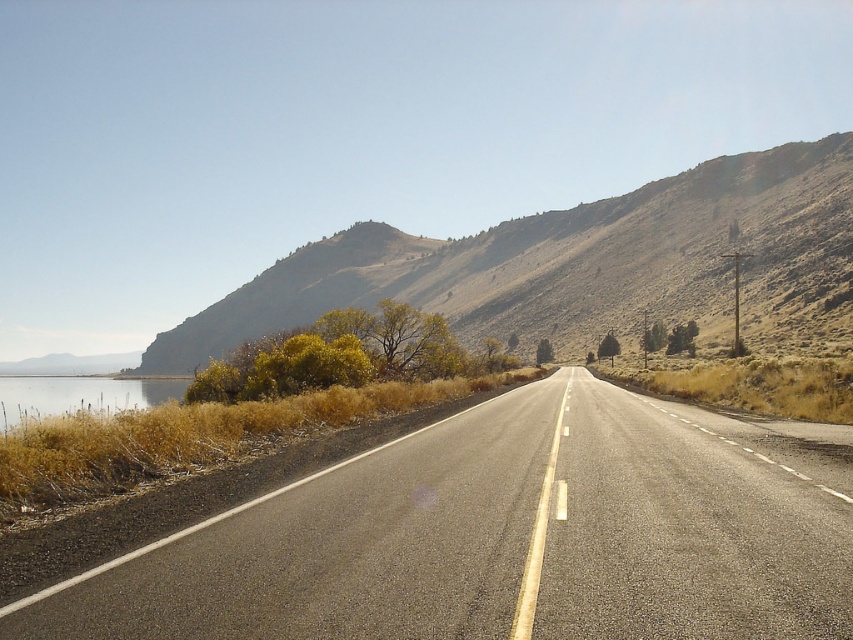
Question: Which of the following is the farthest from the observer?

Choices:
 (A) clear water at left
 (B) dull brown hillside at upper center

Answer: (B)

Question: Does asphalt road at center have a greater width compared to clear water at left?

Choices:
 (A) yes
 (B) no

Answer: (B)

Question: Among these points, which one is farthest from the camera?

Choices:
 (A) (30, 404)
 (B) (572, 292)

Answer: (B)

Question: Which object is closer to the camera taking this photo?

Choices:
 (A) asphalt road at center
 (B) dull brown hillside at upper center

Answer: (A)

Question: Does asphalt road at center come in front of dull brown hillside at upper center?

Choices:
 (A) no
 (B) yes

Answer: (B)

Question: Does asphalt road at center lie in front of dull brown hillside at upper center?

Choices:
 (A) yes
 (B) no

Answer: (A)